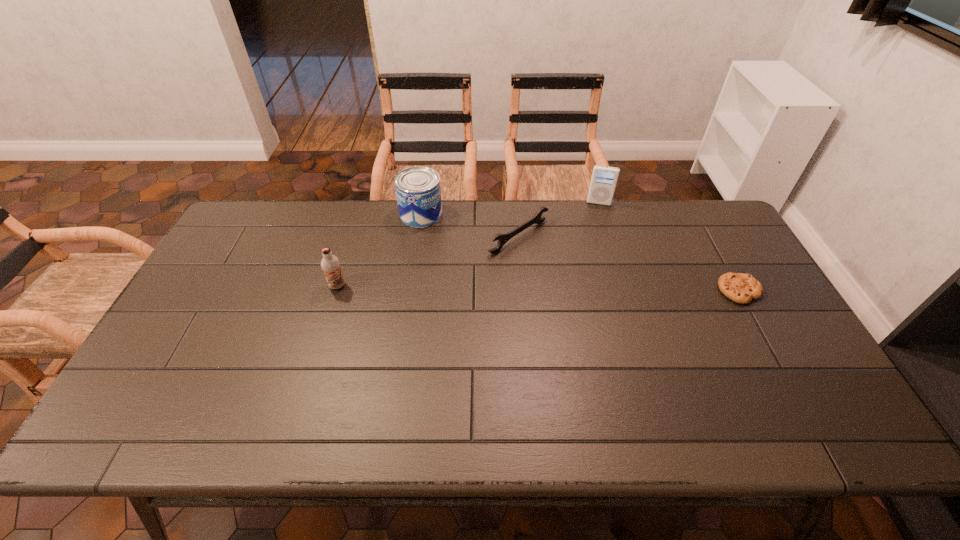
At what (x,y) coordinates should I click in order to perform the action: click on vacant space that satisfies the following two spatial constraints: 1. on the back side of the second shortest object; 2. on the left side of the iPod. Please return your answer as a coordinate pair (x, y). The width and height of the screenshot is (960, 540). Looking at the image, I should click on tap(516, 203).

Image resolution: width=960 pixels, height=540 pixels. Find the location of `vacant space that satisfies the following two spatial constraints: 1. on the back side of the chocolate milk; 2. on the right side of the can`. vacant space that satisfies the following two spatial constraints: 1. on the back side of the chocolate milk; 2. on the right side of the can is located at coordinates (359, 214).

Where is `vacant position in the image that satisfies the following two spatial constraints: 1. on the back side of the leftmost object; 2. on the left side of the iPod`? vacant position in the image that satisfies the following two spatial constraints: 1. on the back side of the leftmost object; 2. on the left side of the iPod is located at coordinates (363, 203).